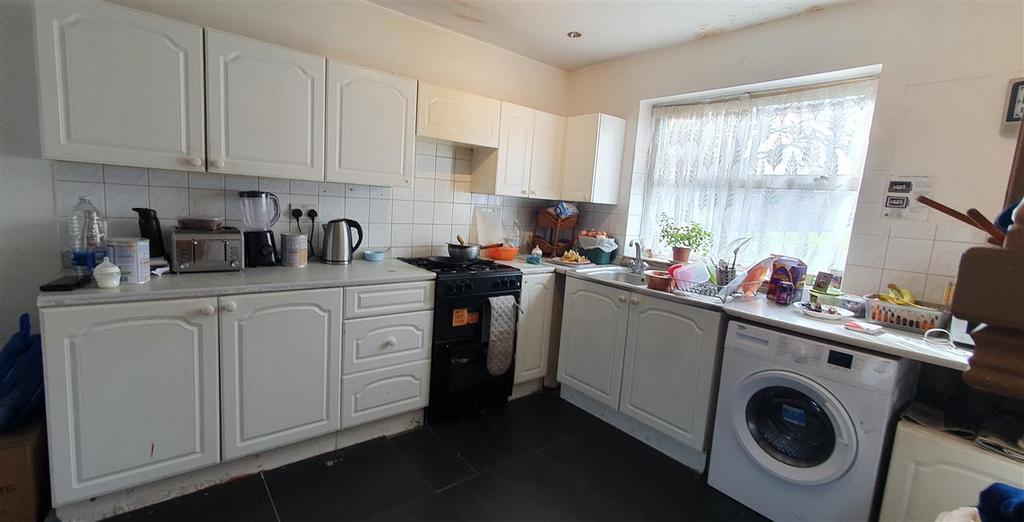
At what (x,y) coordinates should I click in order to perform the action: click on cabinet door handles knobs. Please return your answer as a coordinate pair (x, y). Looking at the image, I should click on (634, 302), (622, 300), (392, 339), (232, 304), (209, 307), (196, 160), (213, 160), (519, 194), (531, 194).